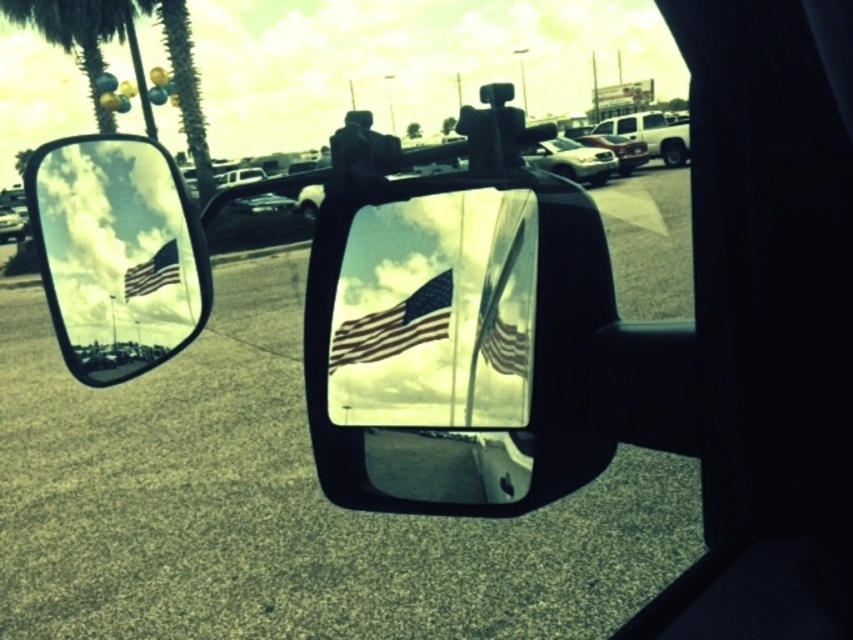
Question: Which point is closer to the camera?

Choices:
 (A) (16, 225)
 (B) (639, 131)

Answer: (A)

Question: Does shiny silver car at center have a greater width compared to metallic silver car at left?

Choices:
 (A) no
 (B) yes

Answer: (B)

Question: Is american flag at center wider than white matte truck at upper right?

Choices:
 (A) no
 (B) yes

Answer: (A)

Question: Does reflective glass mirror at left have a lesser width compared to metallic silver car at left?

Choices:
 (A) yes
 (B) no

Answer: (A)

Question: Considering the real-world distances, which object is farthest from the matte silver sedan at center?

Choices:
 (A) white glossy suv at center
 (B) shiny silver car at center

Answer: (B)

Question: Among these objects, which one is farthest from the camera?

Choices:
 (A) white matte truck at upper right
 (B) green leafy palm tree at upper left

Answer: (A)